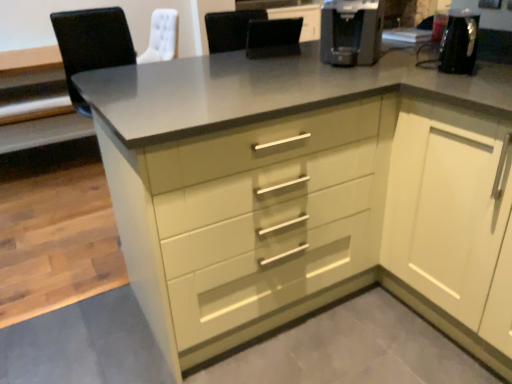
Question: Does white glossy cabinet at right have a lesser width compared to black plastic coffee machine at upper right?

Choices:
 (A) no
 (B) yes

Answer: (A)

Question: Is white glossy cabinet at right positioned with its back to black plastic coffee machine at upper right?

Choices:
 (A) no
 (B) yes

Answer: (A)

Question: From a real-world perspective, is white glossy cabinet at right physically above black plastic coffee machine at upper right?

Choices:
 (A) no
 (B) yes

Answer: (A)

Question: Is white glossy cabinet at right not near black plastic coffee machine at upper right?

Choices:
 (A) no
 (B) yes

Answer: (A)

Question: From the image's perspective, is white glossy cabinet at right on top of black plastic coffee machine at upper right?

Choices:
 (A) yes
 (B) no

Answer: (B)

Question: Considering the relative sizes of white glossy cabinet at right and black plastic coffee machine at upper right in the image provided, is white glossy cabinet at right smaller than black plastic coffee machine at upper right?

Choices:
 (A) yes
 (B) no

Answer: (B)

Question: Is white glossy cabinet at right far away from black leather chair at center?

Choices:
 (A) yes
 (B) no

Answer: (B)

Question: Considering the relative sizes of white glossy cabinet at right and black leather chair at center in the image provided, is white glossy cabinet at right bigger than black leather chair at center?

Choices:
 (A) yes
 (B) no

Answer: (A)

Question: Is white glossy cabinet at right smaller than black leather chair at center?

Choices:
 (A) yes
 (B) no

Answer: (B)

Question: Is white glossy cabinet at right facing towards black leather chair at center?

Choices:
 (A) no
 (B) yes

Answer: (B)

Question: Is white glossy cabinet at right positioned beyond the bounds of black leather chair at center?

Choices:
 (A) no
 (B) yes

Answer: (B)

Question: Does white glossy cabinet at right appear on the right side of black leather chair at center?

Choices:
 (A) no
 (B) yes

Answer: (B)

Question: Considering the relative sizes of black leather chair at center and black plastic coffee machine at upper right in the image provided, is black leather chair at center smaller than black plastic coffee machine at upper right?

Choices:
 (A) no
 (B) yes

Answer: (B)